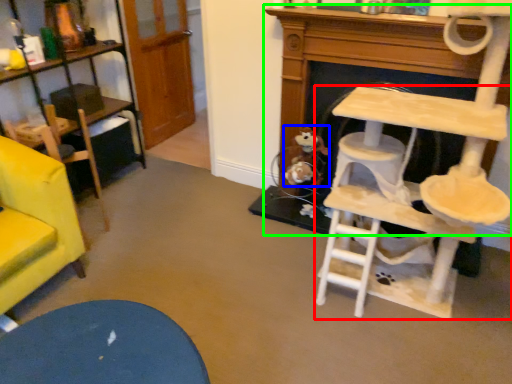
Question: Estimate the real-world distances between objects in this image. Which object is farther from table (highlighted by a red box), toy (highlighted by a blue box) or fireplace (highlighted by a green box)?

Choices:
 (A) toy
 (B) fireplace

Answer: (A)